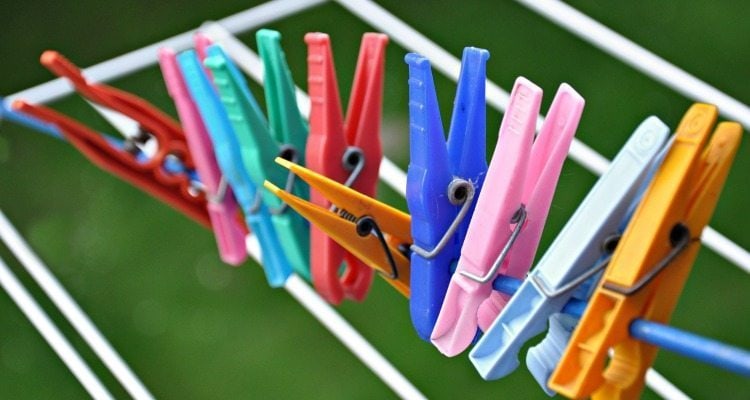
I want to click on 3 white cords in the middle, so click(x=738, y=245), click(x=666, y=381), click(x=405, y=377).